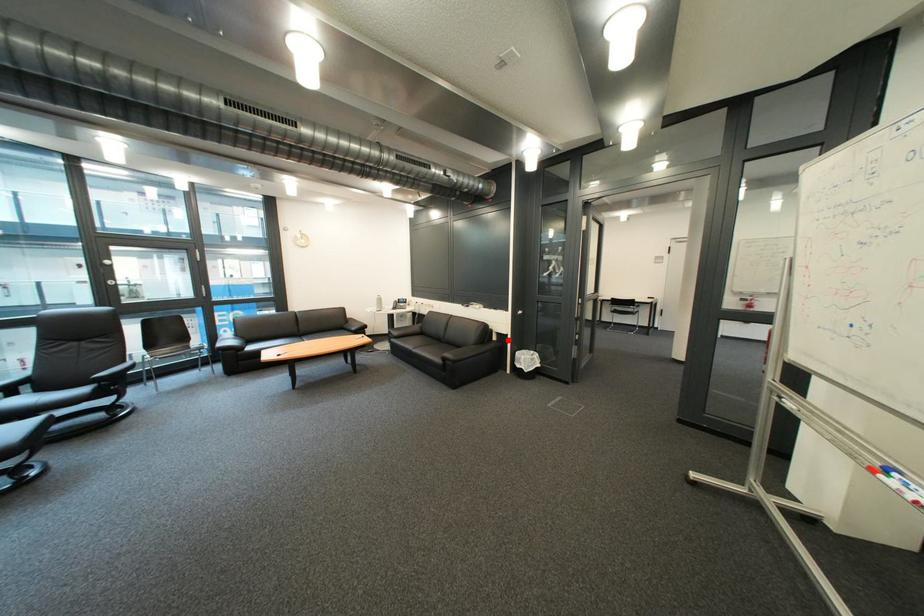
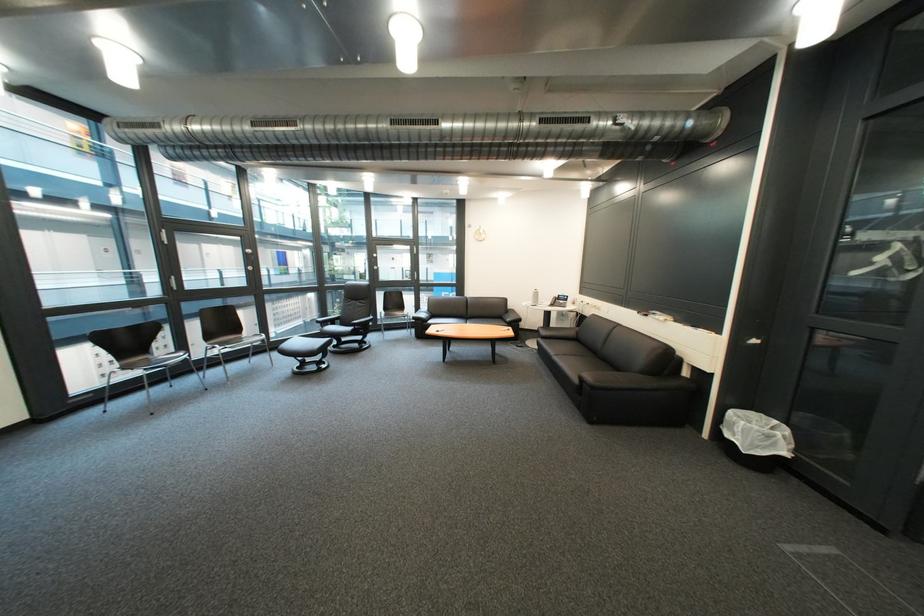
Question: I am providing you with two images of the same scene from different viewpoints. Given a red point in image1, look at the same physical point in image2. Is it:

Choices:
 (A) Closer to the viewpoint
 (B) Farther from the viewpoint

Answer: (A)